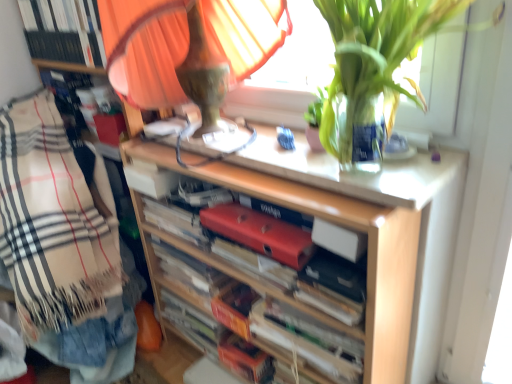
Where is `free location above red matte folder at center, the 3th book when ordered from bottom to top (from a real-world perspective)`? This screenshot has height=384, width=512. free location above red matte folder at center, the 3th book when ordered from bottom to top (from a real-world perspective) is located at coordinates (176, 216).